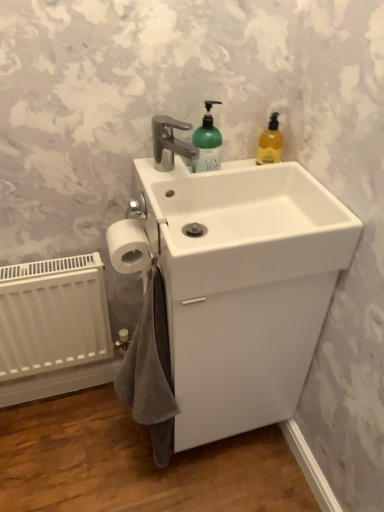
I want to click on free spot in front of translucent amber liquid soap at upper right, so click(283, 183).